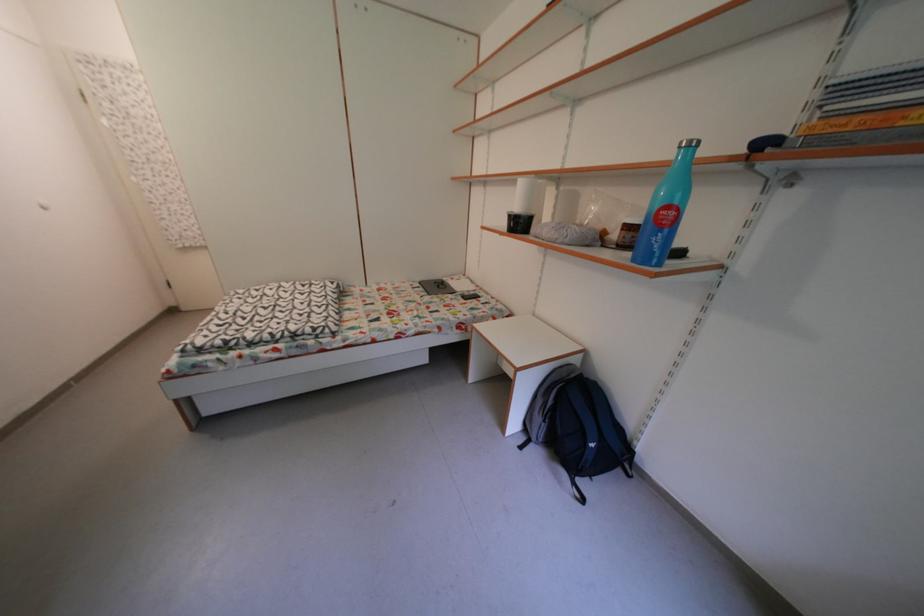
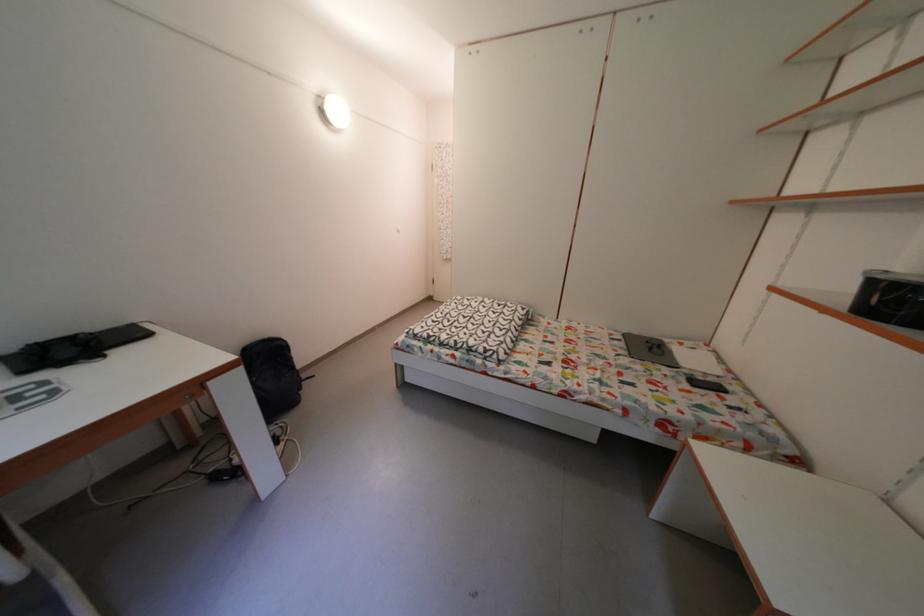
Question: The camera is either moving clockwise (left) or counter-clockwise (right) around the object. The first image is from the beginning of the video and the second image is from the end. Is the camera moving left or right when shooting the video?

Choices:
 (A) Left
 (B) Right

Answer: (B)